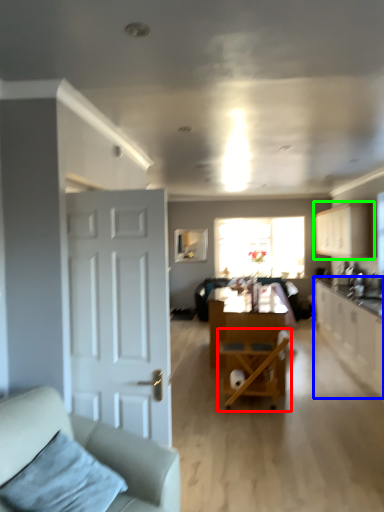
Question: Which object is positioned farthest from chair (highlighted by a red box)? Select from cabinetry (highlighted by a blue box) and cabinetry (highlighted by a green box).

Choices:
 (A) cabinetry
 (B) cabinetry

Answer: (B)